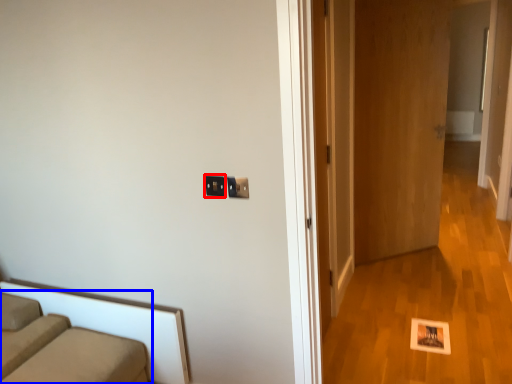
Question: Which of the following is the farthest to the observer, electric outlet (highlighted by a red box) or studio couch (highlighted by a blue box)?

Choices:
 (A) electric outlet
 (B) studio couch

Answer: (A)